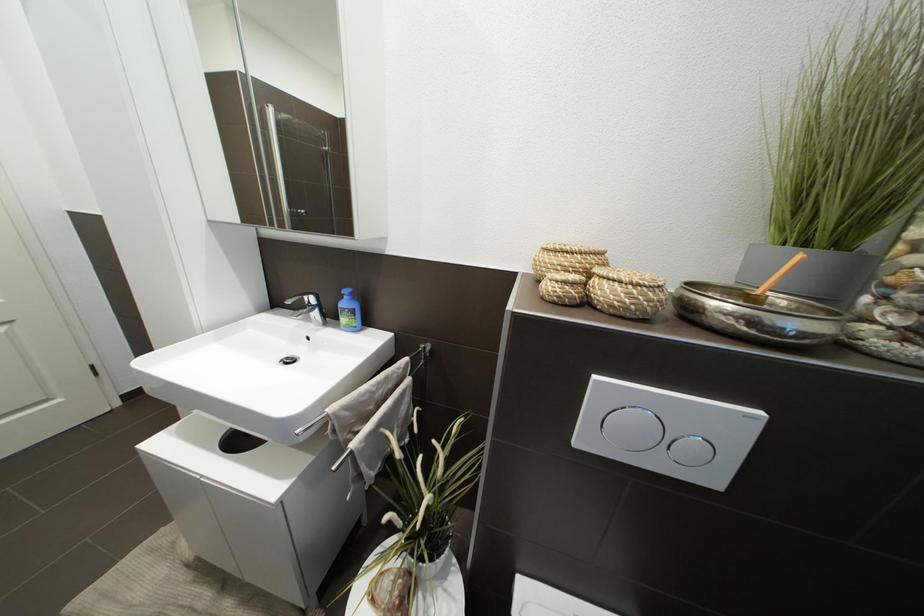
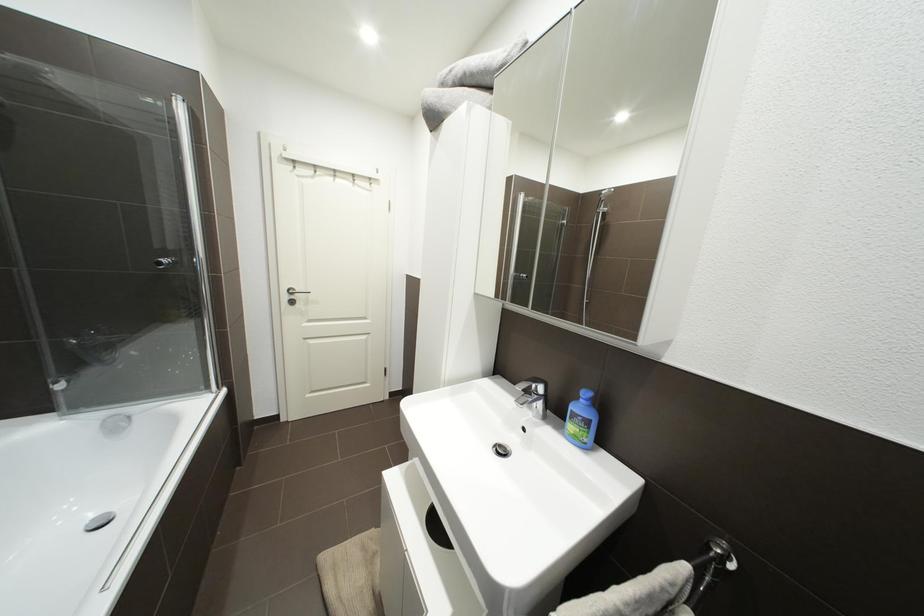
Question: The first image is from the beginning of the video and the second image is from the end. How did the camera likely rotate when shooting the video?

Choices:
 (A) Left
 (B) Right
 (C) Up
 (D) Down

Answer: (A)